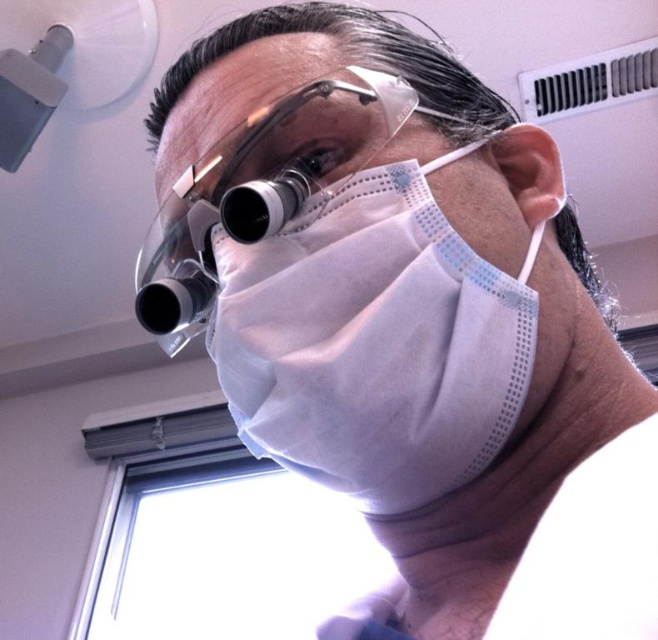
You are a medical equipment inspector checking the spacing between the white matte mask at center and transparent plastic goggles at center. According to safety guidelines, the minimum required distance is 2 inches. Is the current spacing compliant?

The distance between the white matte mask at center and transparent plastic goggles at center is 2.28 inches, which exceeds the minimum required 2 inches, so it is compliant with safety guidelines.

Consider the image. You are a healthcare worker preparing to wear both the white matte mask at center and the transparent plastic goggles at center. Based on their sizes, which one should you put on first to ensure proper positioning?

The white matte mask at center has a smaller size compared to the transparent plastic goggles at center. Therefore, you should put on the white matte mask at center first to avoid adjusting it after placing the larger goggles.

You are a healthcare worker preparing to don a white matte mask at center. If your face is 12 inches away from the mask, will you need to adjust your position before placing it on your face?

The white matte mask at center is currently 13.65 inches away from the viewer. Since your face is only 12 inches away from the mask, you need to move back slightly to ensure proper placement.